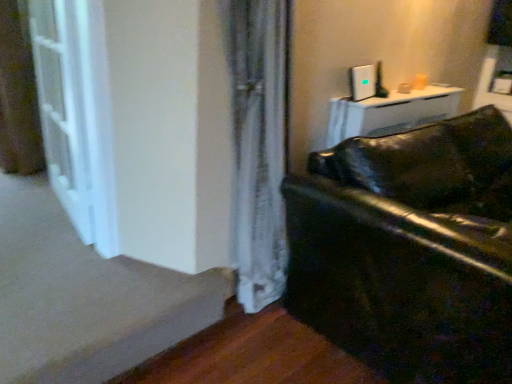
Question: Is glossy black leather couch at lower right at the left side of smooth beige carpet at lower left?

Choices:
 (A) no
 (B) yes

Answer: (A)

Question: Is glossy black leather couch at lower right behind smooth beige carpet at lower left?

Choices:
 (A) yes
 (B) no

Answer: (B)

Question: From the image's perspective, is glossy black leather couch at lower right above smooth beige carpet at lower left?

Choices:
 (A) no
 (B) yes

Answer: (B)

Question: Does glossy black leather couch at lower right have a lesser width compared to smooth beige carpet at lower left?

Choices:
 (A) yes
 (B) no

Answer: (B)

Question: Considering the relative sizes of glossy black leather couch at lower right and smooth beige carpet at lower left in the image provided, is glossy black leather couch at lower right bigger than smooth beige carpet at lower left?

Choices:
 (A) no
 (B) yes

Answer: (B)

Question: Is point (449, 350) positioned closer to the camera than point (113, 196)?

Choices:
 (A) farther
 (B) closer

Answer: (B)

Question: Visually, is glossy black leather couch at lower right positioned to the left or to the right of white glossy screen door at left?

Choices:
 (A) right
 (B) left

Answer: (A)

Question: Is glossy black leather couch at lower right wider or thinner than white glossy screen door at left?

Choices:
 (A) thin
 (B) wide

Answer: (B)

Question: In the image, is glossy black leather couch at lower right positioned in front of or behind white glossy screen door at left?

Choices:
 (A) front
 (B) behind

Answer: (A)

Question: In the image, is white glossy screen door at left positioned in front of or behind glossy black leather couch at lower right?

Choices:
 (A) front
 (B) behind

Answer: (B)

Question: Is point (88, 240) positioned closer to the camera than point (437, 347)?

Choices:
 (A) farther
 (B) closer

Answer: (A)

Question: From a real-world perspective, is white glossy screen door at left positioned above or below glossy black leather couch at lower right?

Choices:
 (A) above
 (B) below

Answer: (A)

Question: Is white glossy screen door at left bigger or smaller than glossy black leather couch at lower right?

Choices:
 (A) small
 (B) big

Answer: (A)

Question: From the image's perspective, is glossy black leather couch at lower right positioned above or below smooth beige carpet at lower left?

Choices:
 (A) below
 (B) above

Answer: (B)

Question: Considering the positions of point (327, 274) and point (72, 279), is point (327, 274) closer or farther from the camera than point (72, 279)?

Choices:
 (A) farther
 (B) closer

Answer: (B)